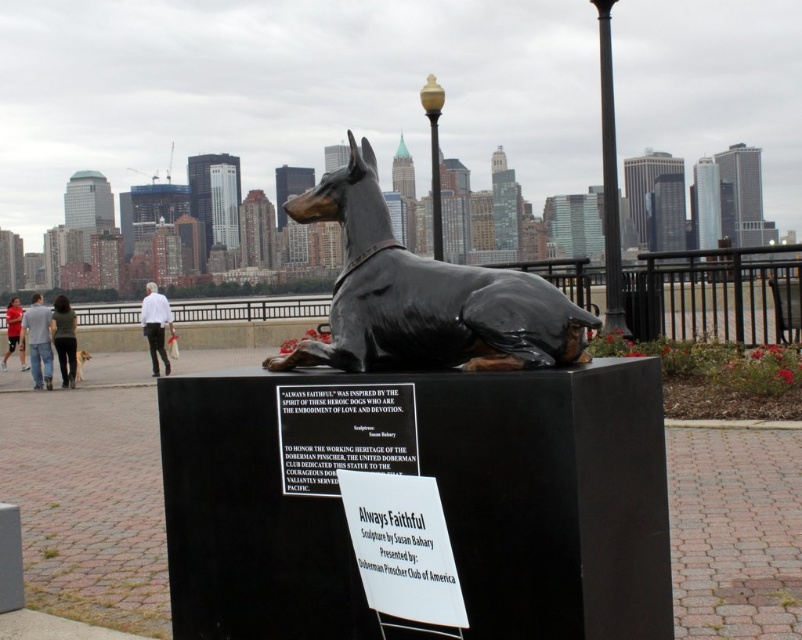
Question: Where is jeans at center located in relation to brown glossy statue at center in the image?

Choices:
 (A) left
 (B) right

Answer: (A)

Question: Which object is positioned closest to the black glossy doberman at center?

Choices:
 (A) jeans at center
 (B) white shirt at center
 (C) red shirt at center
 (D) dark green jacket at center

Answer: (A)

Question: In this image, where is white shirt at center located relative to red shirt at center?

Choices:
 (A) below
 (B) above

Answer: (B)

Question: Estimate the real-world distances between objects in this image. Which object is closer to the red shirt at center?

Choices:
 (A) brown glossy statue at center
 (B) black glossy doberman at center
 (C) dark green jacket at center
 (D) jeans at center

Answer: (D)

Question: Does black glossy doberman at center appear on the left side of dark green jacket at center?

Choices:
 (A) yes
 (B) no

Answer: (B)

Question: Which object is farther from the camera taking this photo?

Choices:
 (A) red shirt at center
 (B) white shirt at center
 (C) dark green jacket at center

Answer: (A)